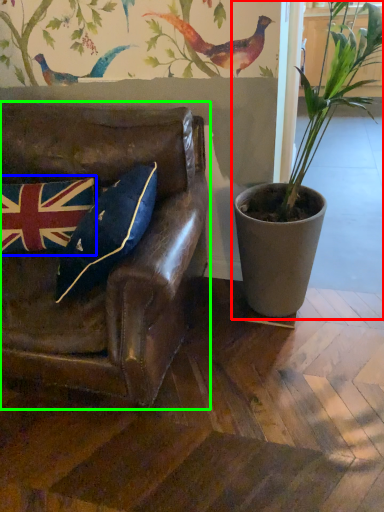
Question: Estimate the real-world distances between objects in this image. Which object is closer to houseplant (highlighted by a red box), flag (highlighted by a blue box) or chair (highlighted by a green box)?

Choices:
 (A) flag
 (B) chair

Answer: (B)